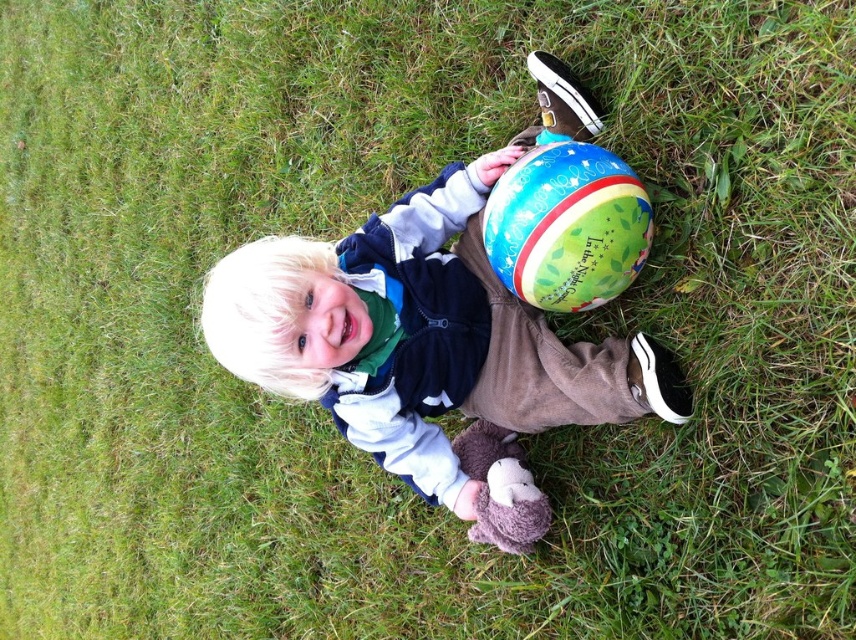
Question: Among these points, which one is farthest from the camera?

Choices:
 (A) (569, 147)
 (B) (281, 388)

Answer: (B)

Question: In this image, where is matte blue ball at center located relative to multicolored fabric beach ball at center?

Choices:
 (A) above
 (B) below

Answer: (B)

Question: Does matte blue ball at center appear on the right side of multicolored fabric beach ball at center?

Choices:
 (A) no
 (B) yes

Answer: (A)

Question: Which of the following is the farthest from the observer?

Choices:
 (A) multicolored fabric beach ball at center
 (B) matte blue ball at center

Answer: (B)

Question: Does matte blue ball at center lie behind multicolored fabric beach ball at center?

Choices:
 (A) yes
 (B) no

Answer: (A)

Question: Among these points, which one is farthest from the camera?

Choices:
 (A) (609, 291)
 (B) (363, 243)

Answer: (B)